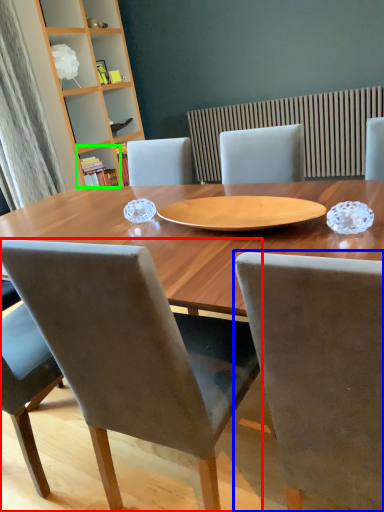
Question: Estimate the real-world distances between objects in this image. Which object is closer to chair (highlighted by a red box), chair (highlighted by a blue box) or shelf (highlighted by a green box)?

Choices:
 (A) chair
 (B) shelf

Answer: (A)